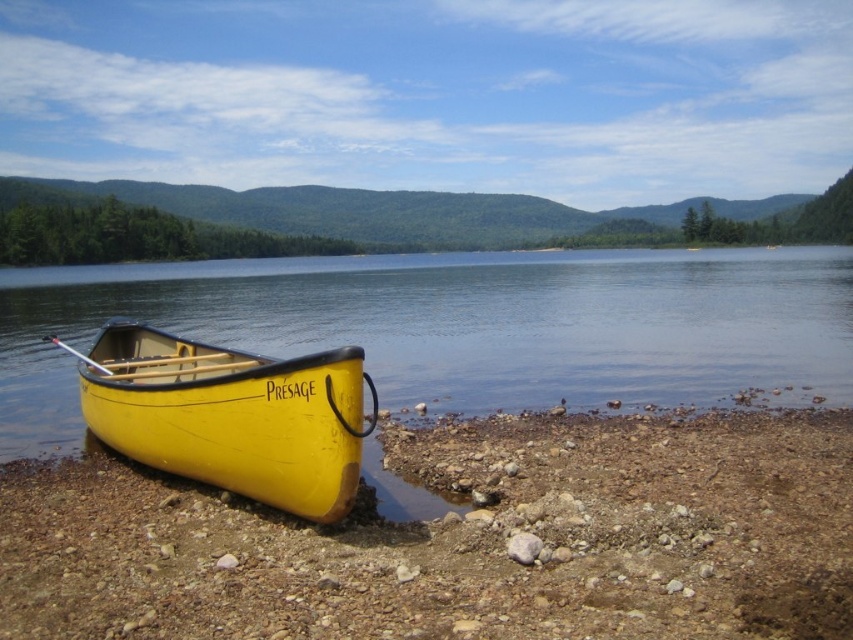
Can you confirm if yellow wood canoe at lower left is smaller than yellow matte wood canoe at lower left?

Correct, yellow wood canoe at lower left occupies less space than yellow matte wood canoe at lower left.

Is yellow wood canoe at lower left further to camera compared to yellow matte wood canoe at lower left?

Yes, yellow wood canoe at lower left is further from the viewer.

Who is more forward, (746, 481) or (288, 426)?

Point (288, 426) is in front.

Where is `yellow wood canoe at lower left`? yellow wood canoe at lower left is located at coordinates (461, 540).

Based on the photo, can you confirm if yellow wood water at lower left is shorter than yellow matte wood canoe at lower left?

Incorrect, yellow wood water at lower left's height does not fall short of yellow matte wood canoe at lower left's.

Is yellow wood water at lower left positioned at the back of yellow matte wood canoe at lower left?

Yes, it is.

Is point (393, 380) farther from camera compared to point (289, 358)?

Yes, point (393, 380) is behind point (289, 358).

Find the location of `yellow wood water at lower left`. yellow wood water at lower left is located at coordinates (457, 324).

Who is more distant from viewer, [310,564] or [643,403]?

The point [643,403] is more distant.

This screenshot has width=853, height=640. Identify the location of yellow wood canoe at lower left. (461, 540).

Locate an element on the screen. yellow wood canoe at lower left is located at coordinates (461, 540).